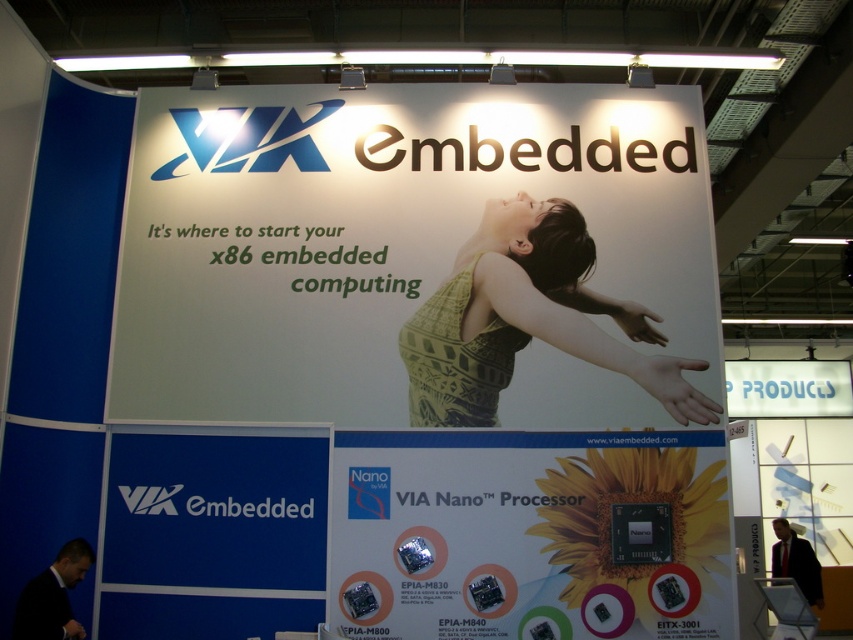
Question: Can you confirm if white paper billboard at center is positioned to the left of green knitted tank top at center?

Choices:
 (A) yes
 (B) no

Answer: (A)

Question: Which object is positioned farthest from the silvery metallic via nano processor at center?

Choices:
 (A) white paper billboard at center
 (B) green knitted tank top at center

Answer: (A)

Question: Is the position of white paper billboard at center more distant than that of green knitted tank top at center?

Choices:
 (A) yes
 (B) no

Answer: (B)

Question: Is silvery metallic via nano processor at center thinner than green knitted tank top at center?

Choices:
 (A) no
 (B) yes

Answer: (A)

Question: Which point is closer to the camera?

Choices:
 (A) silvery metallic via nano processor at center
 (B) green knitted tank top at center
 (C) white paper billboard at center

Answer: (A)

Question: Which of the following is the farthest from the observer?

Choices:
 (A) (357, 406)
 (B) (437, 314)
 (C) (703, 627)

Answer: (B)